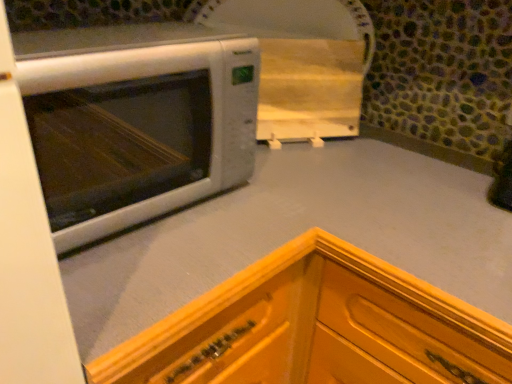
Where is `white glossy microwave at upper left`? The image size is (512, 384). white glossy microwave at upper left is located at coordinates (139, 131).

Measure the distance between point [160,57] and camera.

They are 24.84 inches apart.

What do you see at coordinates (139, 131) in the screenshot? The width and height of the screenshot is (512, 384). I see `white glossy microwave at upper left` at bounding box center [139, 131].

Identify the location of white glossy microwave at upper left. This screenshot has height=384, width=512. (139, 131).